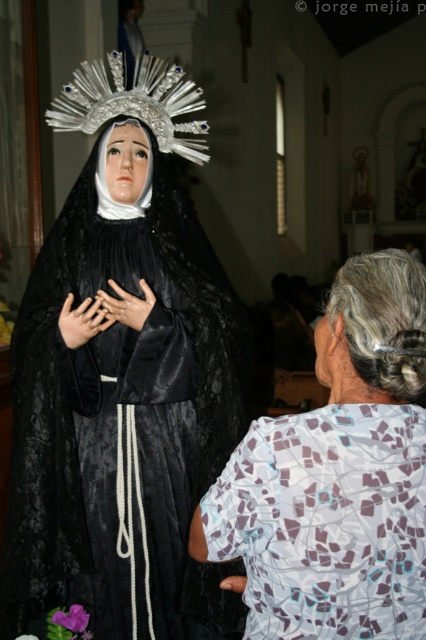
Measure the distance from matte black statue at center to printed fabric blouse at lower right.

A distance of 33.65 inches exists between matte black statue at center and printed fabric blouse at lower right.

Between point (180, 390) and point (324, 481), which one is positioned in front?

Point (324, 481)

Describe the element at coordinates (123, 376) in the screenshot. I see `matte black statue at center` at that location.

You are a GUI agent. You are given a task and a screenshot of the screen. Output one action in this format:
    pyautogui.click(x=<x>, y=<y>)
    Task: Click on the matte black statue at center
    
    Given the screenshot: What is the action you would take?
    pyautogui.click(x=123, y=376)